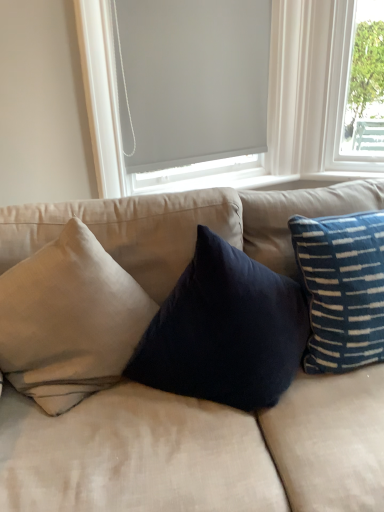
Describe the element at coordinates (342, 289) in the screenshot. The image size is (384, 512). I see `blue striped pillow at right, which is the first pillow in right-to-left order` at that location.

This screenshot has height=512, width=384. I want to click on matte gray roller shade at upper center, so click(268, 99).

Could you tell me if blue striped pillow at right, which is the first pillow in right-to-left order, is turned towards beige fabric couch at center?

Yes, blue striped pillow at right, which is the first pillow in right-to-left order, is oriented towards beige fabric couch at center.

In the scene shown: From a real-world perspective, who is located higher, blue striped pillow at right, which is the second pillow from left to right, or beige fabric couch at center?

From a 3D spatial view, blue striped pillow at right, which is the second pillow from left to right, is above.

Is blue striped pillow at right, which is the second pillow from left to right, at the left side of beige fabric couch at center?

No.

From the image's perspective, is blue striped pillow at right, which is the second pillow from left to right, positioned above or below beige fabric couch at center?

Clearly, from the image's perspective, blue striped pillow at right, which is the second pillow from left to right, is above beige fabric couch at center.

Is beige fabric couch at center with blue striped pillow at right, which is the second pillow from left to right?

beige fabric couch at center and blue striped pillow at right, which is the second pillow from left to right, are not in contact.

Considering the sizes of beige fabric couch at center and blue striped pillow at right, which is the second pillow from left to right, in the image, is beige fabric couch at center bigger or smaller than blue striped pillow at right, which is the second pillow from left to right,?

Considering their sizes, beige fabric couch at center takes up more space than blue striped pillow at right, which is the second pillow from left to right.

Is beige fabric couch at center inside the boundaries of blue striped pillow at right, which is the first pillow in right-to-left order, or outside?

beige fabric couch at center lies outside blue striped pillow at right, which is the first pillow in right-to-left order.

How different are the orientations of beige cotton cushion at left, positioned as the first pillow in left-to-right order, and matte gray roller shade at upper center in degrees?

The facing directions of beige cotton cushion at left, positioned as the first pillow in left-to-right order, and matte gray roller shade at upper center are 21.5 degrees apart.

Is beige cotton cushion at left, the second pillow when ordered from right to left, placed right next to matte gray roller shade at upper center?

They are not placed beside each other.

Is beige cotton cushion at left, the second pillow when ordered from right to left, taller or shorter than matte gray roller shade at upper center?

beige cotton cushion at left, the second pillow when ordered from right to left, is shorter than matte gray roller shade at upper center.

Is point (14, 367) farther from camera compared to point (306, 10)?

No, (14, 367) is in front of (306, 10).

Which object is wider, gray matte window screen at upper center or beige fabric couch at center?

beige fabric couch at center.

Is gray matte window screen at upper center facing towards beige fabric couch at center?

Yes.

Can you confirm if gray matte window screen at upper center is smaller than beige fabric couch at center?

Yes.

Does matte gray roller shade at upper center appear on the right side of beige fabric couch at center?

No, matte gray roller shade at upper center is not to the right of beige fabric couch at center.

From a real-world perspective, is matte gray roller shade at upper center above or below beige fabric couch at center?

matte gray roller shade at upper center is above beige fabric couch at center.

Which is closer, (313, 145) or (317, 479)?

Point (313, 145).

Between matte gray roller shade at upper center and beige fabric couch at center, which one has larger size?

Bigger between the two is beige fabric couch at center.

From the image's perspective, is beige fabric couch at center below beige cotton cushion at left, positioned as the first pillow in left-to-right order?

Yes, from the image's perspective, beige fabric couch at center is below beige cotton cushion at left, positioned as the first pillow in left-to-right order.

In terms of height, does beige fabric couch at center look taller or shorter compared to beige cotton cushion at left, the second pillow when ordered from right to left?

Considering their sizes, beige fabric couch at center has more height than beige cotton cushion at left, the second pillow when ordered from right to left.

In terms of size, does beige fabric couch at center appear bigger or smaller than beige cotton cushion at left, positioned as the first pillow in left-to-right order?

Clearly, beige fabric couch at center is larger in size than beige cotton cushion at left, positioned as the first pillow in left-to-right order.

Which object is positioned more to the left, beige fabric couch at center or beige cotton cushion at left, the second pillow when ordered from right to left?

Positioned to the left is beige cotton cushion at left, the second pillow when ordered from right to left.

Does point (84, 396) lie behind point (353, 259)?

No, (84, 396) is closer to viewer.

What's the angular difference between beige cotton cushion at left, positioned as the first pillow in left-to-right order, and blue striped pillow at right, which is the first pillow in right-to-left order,'s facing directions?

There is a 6.34-degree angle between the facing directions of beige cotton cushion at left, positioned as the first pillow in left-to-right order, and blue striped pillow at right, which is the first pillow in right-to-left order.

Does beige cotton cushion at left, positioned as the first pillow in left-to-right order, lie behind blue striped pillow at right, which is the first pillow in right-to-left order?

No, it is in front of blue striped pillow at right, which is the first pillow in right-to-left order.

Is beige cotton cushion at left, the second pillow when ordered from right to left, taller or shorter than blue striped pillow at right, which is the second pillow from left to right?

Clearly, beige cotton cushion at left, the second pillow when ordered from right to left, is taller compared to blue striped pillow at right, which is the second pillow from left to right.

Find the location of a particular element. studio couch below the blue striped pillow at right, which is the second pillow from left to right (from the image's perspective) is located at coordinates (199, 450).

At what (x,y) coordinates should I click in order to perform the action: click on pillow on the right of beige fabric couch at center. Please return your answer as a coordinate pair (x, y). The image size is (384, 512). Looking at the image, I should click on (342, 289).

Which object lies further to the anchor point blue striped pillow at right, which is the second pillow from left to right, beige fabric couch at center or gray matte window screen at upper center?

gray matte window screen at upper center.

From the picture: From the image, which object appears to be nearer to beige cotton cushion at left, the second pillow when ordered from right to left, matte gray roller shade at upper center or gray matte window screen at upper center?

matte gray roller shade at upper center is positioned closer to the anchor beige cotton cushion at left, the second pillow when ordered from right to left.

Looking at the image, which one is located further to matte gray roller shade at upper center, beige cotton cushion at left, the second pillow when ordered from right to left, or beige fabric couch at center?

beige fabric couch at center lies further to matte gray roller shade at upper center than the other object.

When comparing their distances from gray matte window screen at upper center, does blue striped pillow at right, which is the first pillow in right-to-left order, or beige cotton cushion at left, the second pillow when ordered from right to left, seem further?

Among the two, blue striped pillow at right, which is the first pillow in right-to-left order, is located further to gray matte window screen at upper center.

Looking at the image, which one is located closer to beige cotton cushion at left, the second pillow when ordered from right to left, gray matte window screen at upper center or matte gray roller shade at upper center?

matte gray roller shade at upper center is closer to beige cotton cushion at left, the second pillow when ordered from right to left.

Which object lies further to the anchor point beige fabric couch at center, gray matte window screen at upper center or beige cotton cushion at left, positioned as the first pillow in left-to-right order?

Among the two, gray matte window screen at upper center is located further to beige fabric couch at center.

Looking at the image, which one is located closer to blue striped pillow at right, which is the second pillow from left to right, matte gray roller shade at upper center or beige cotton cushion at left, the second pillow when ordered from right to left?

beige cotton cushion at left, the second pillow when ordered from right to left, is closer to blue striped pillow at right, which is the second pillow from left to right.

From the image, which object appears to be nearer to blue striped pillow at right, which is the second pillow from left to right, matte gray roller shade at upper center or beige fabric couch at center?

beige fabric couch at center is positioned closer to the anchor blue striped pillow at right, which is the second pillow from left to right.

At what (x,y) coordinates should I click in order to perform the action: click on window between gray matte window screen at upper center and blue striped pillow at right, which is the first pillow in right-to-left order, vertically. Please return your answer as a coordinate pair (x, y). The image size is (384, 512). Looking at the image, I should click on 268,99.

The height and width of the screenshot is (512, 384). Identify the location of studio couch between beige cotton cushion at left, positioned as the first pillow in left-to-right order, and blue striped pillow at right, which is the first pillow in right-to-left order, in the horizontal direction. (199, 450).

At what (x,y) coordinates should I click in order to perform the action: click on window between gray matte window screen at upper center and beige cotton cushion at left, positioned as the first pillow in left-to-right order, vertically. Please return your answer as a coordinate pair (x, y). The image size is (384, 512). Looking at the image, I should click on point(268,99).

The height and width of the screenshot is (512, 384). What are the coordinates of `pillow that lies between matte gray roller shade at upper center and beige cotton cushion at left, the second pillow when ordered from right to left, from top to bottom` in the screenshot? It's located at (342, 289).